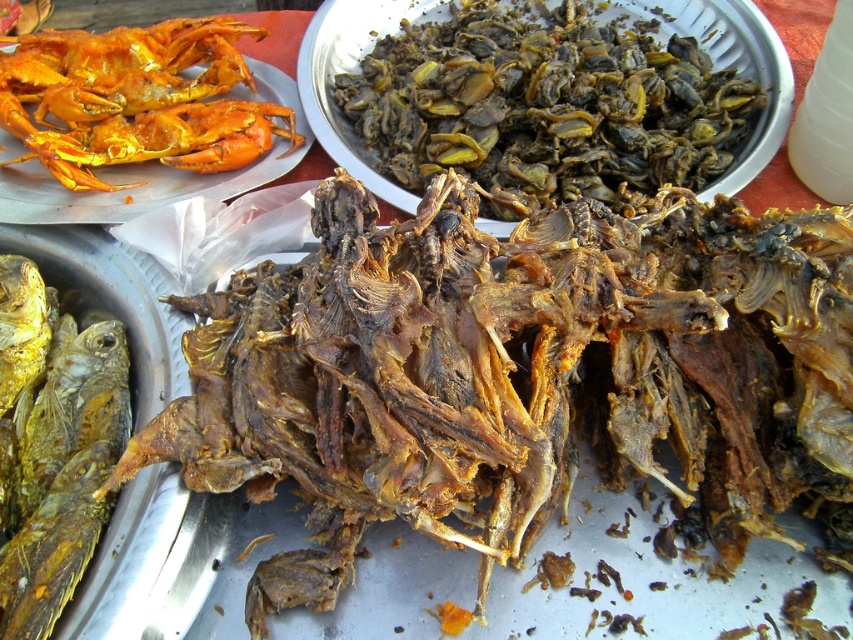
Question: Can you confirm if brown crispy fish at center is positioned to the left of golden crispy crab at upper left?

Choices:
 (A) no
 (B) yes

Answer: (A)

Question: Which point is closer to the camera taking this photo?

Choices:
 (A) (779, 448)
 (B) (515, 144)

Answer: (A)

Question: Is brown crispy insects at upper center positioned behind golden crispy crab at upper left?

Choices:
 (A) yes
 (B) no

Answer: (A)

Question: Which object is closer to the camera taking this photo?

Choices:
 (A) brown crispy fish at center
 (B) brown crispy insects at upper center
 (C) golden crispy crab at upper left

Answer: (A)

Question: Which of the following is the farthest from the observer?

Choices:
 (A) (718, 321)
 (B) (119, 88)

Answer: (B)

Question: Does brown crispy insects at upper center appear on the right side of golden crispy crab at upper left?

Choices:
 (A) yes
 (B) no

Answer: (A)